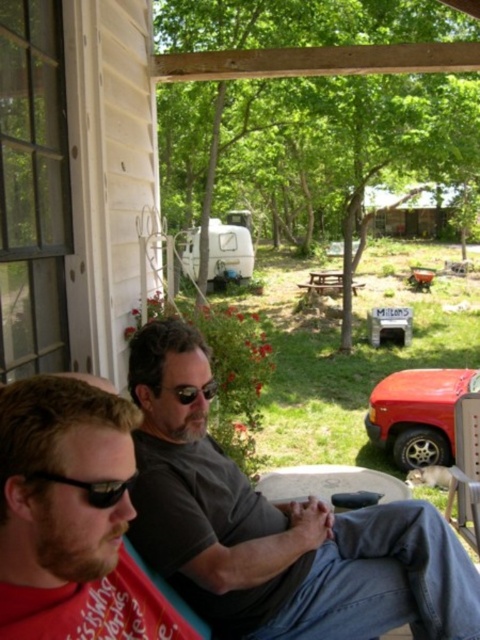
Does gray matte shirt at center appear on the right side of black reflective sunglasses at center?

Yes, gray matte shirt at center is to the right of black reflective sunglasses at center.

Between gray matte shirt at center and black reflective sunglasses at center, which one appears on the left side from the viewer's perspective?

Positioned to the left is black reflective sunglasses at center.

Where is `gray matte shirt at center`? gray matte shirt at center is located at coordinates (276, 529).

Can you confirm if black plastic sunglasses at lower left is wider than black reflective sunglasses at center?

No, black plastic sunglasses at lower left is not wider than black reflective sunglasses at center.

Based on the photo, can you confirm if black plastic sunglasses at lower left is positioned to the right of black reflective sunglasses at center?

No, black plastic sunglasses at lower left is not to the right of black reflective sunglasses at center.

This screenshot has width=480, height=640. What are the coordinates of `black plastic sunglasses at lower left` in the screenshot? It's located at (90, 486).

Is the position of gray matte shirt at center more distant than that of black plastic sunglasses at lower left?

Yes.

Is gray matte shirt at center taller than black plastic sunglasses at lower left?

Yes, gray matte shirt at center is taller than black plastic sunglasses at lower left.

This screenshot has width=480, height=640. Identify the location of gray matte shirt at center. (276, 529).